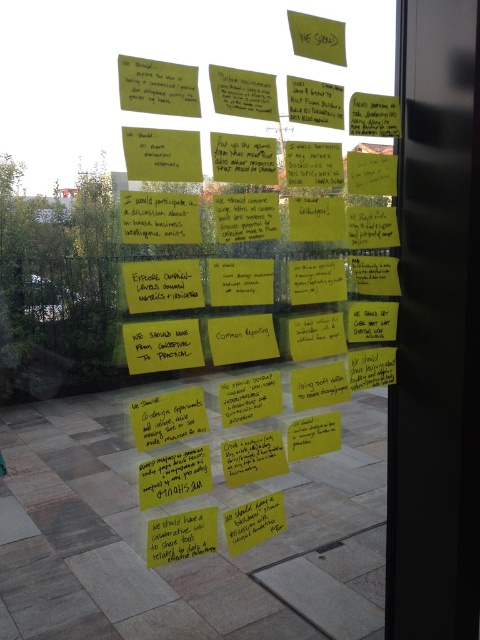
You are an office worker trying to organize the yellow sticky notes at upper center and the yellow sticky notes at right on the glass wall. If you want to place them side by side horizontally, which set of notes should you move to the left to make space?

The yellow sticky notes at upper center are wider than the yellow sticky notes at right, so you should move the yellow sticky notes at upper center to the left to make space for the other set.

You are an office worker who wants to place a new yellow sticky note on the glass wall. You notice two existing notes, the yellow sticky notes at upper center and the yellow sticky notes at right. Which of these two notes is positioned higher up on the wall?

The yellow sticky notes at upper center is positioned higher up on the wall than the yellow sticky notes at right.

You are standing in front of the glass wall and want to place a new yellow sticky note. The current yellow sticky notes at upper center are located at point 0.384, 0.531. Where should you place your new note to avoid overlapping with them?

Place the new yellow sticky note at a different coordinate than (254, 244) to avoid overlapping with the existing yellow sticky notes at upper center.